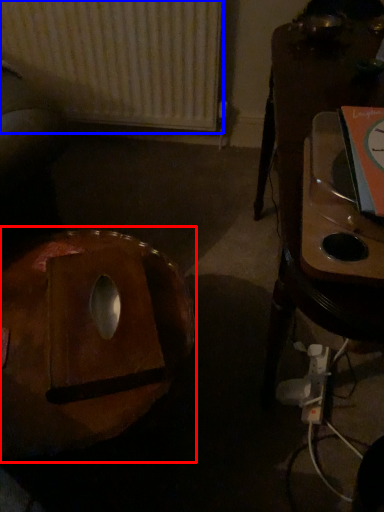
Question: Which of the following is the closest to the observer, bean bag chair (highlighted by a red box) or radiator (highlighted by a blue box)?

Choices:
 (A) bean bag chair
 (B) radiator

Answer: (A)